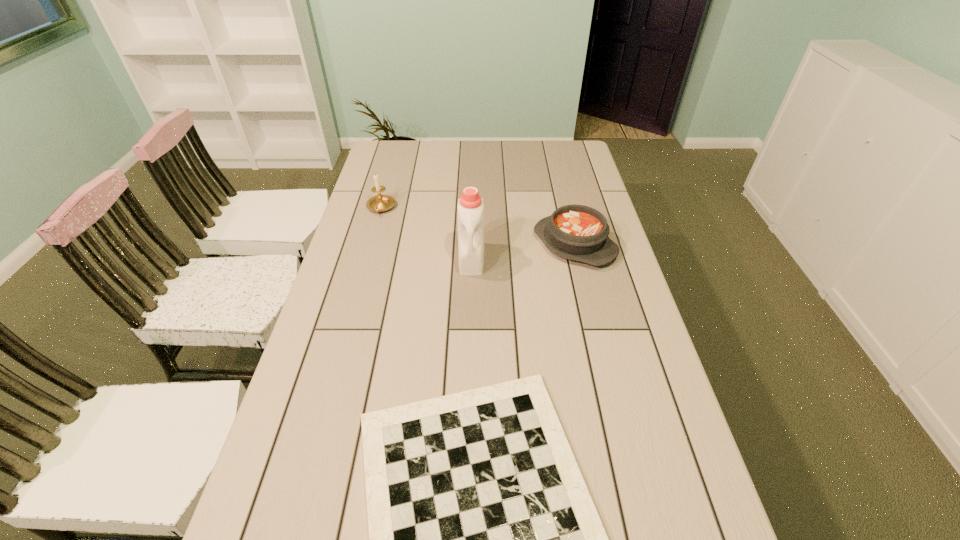
Identify the location of the tallest object. (470, 210).

Image resolution: width=960 pixels, height=540 pixels. In order to click on the farthest object in this screenshot , I will do `click(379, 203)`.

Locate an element on the screen. candle holder is located at coordinates (379, 203).

Find the location of a particular element. Image resolution: width=960 pixels, height=540 pixels. casserole is located at coordinates (575, 232).

The image size is (960, 540). I want to click on vacant space positioned on the handle side of the detergent, so point(469,346).

Identify the location of vacant area situated with a handle on the side of the farthest object. (375, 228).

Locate an element on the screen. vacant space located 0.160m on the front of the casserole is located at coordinates (590, 310).

Identify the location of object located in the left edge section of the desktop. The height and width of the screenshot is (540, 960). (379, 203).

You are a GUI agent. You are given a task and a screenshot of the screen. Output one action in this format:
    pyautogui.click(x=<x>, y=<y>)
    Task: Click on the object that is at the right edge
    
    Given the screenshot: What is the action you would take?
    pyautogui.click(x=575, y=232)

Locate an element on the screen. vacant space at the left edge is located at coordinates (343, 314).